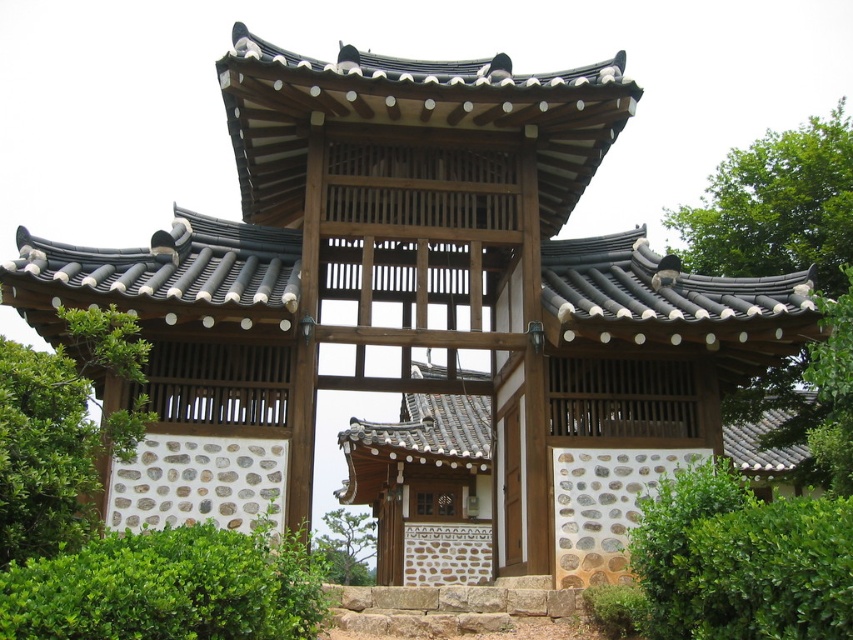
You are standing in front of the traditional Korean gate and notice two green leafy trees. One is labeled as the green leafy tree at left, and the other is the green leafy tree at center. Which tree is positioned further to the left side of the gate?

The green leafy tree at left is positioned further to the left side of the gate compared to the green leafy tree at center.

You are standing in front of the Haenggwan gate and notice two points marked on the structure. The first point is at coordinate point (x=0, y=360) and the second is at point (x=712, y=244). Which of these points is nearer to your current position?

Point (x=0, y=360) is closer to the camera than point (x=712, y=244), so the first point is nearer to your current position.